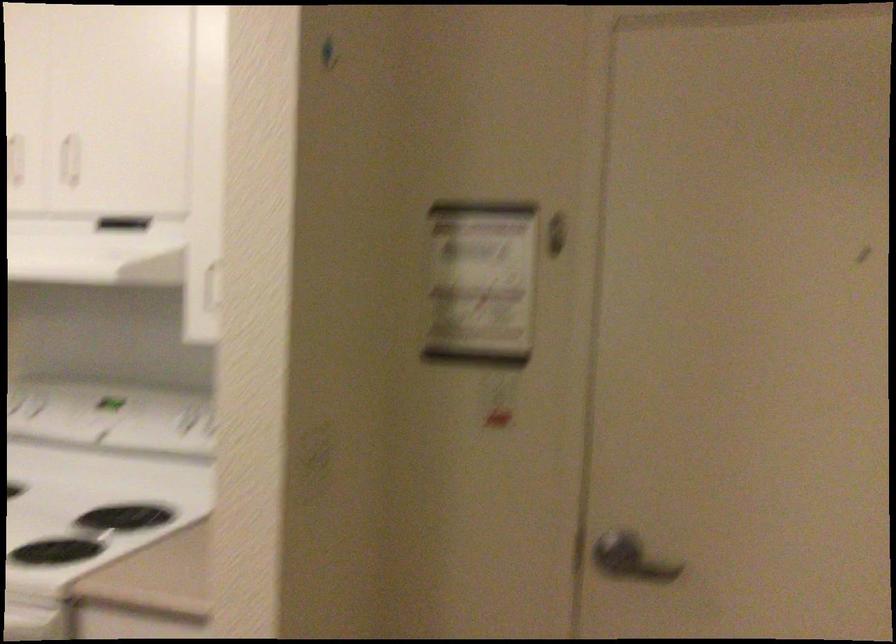
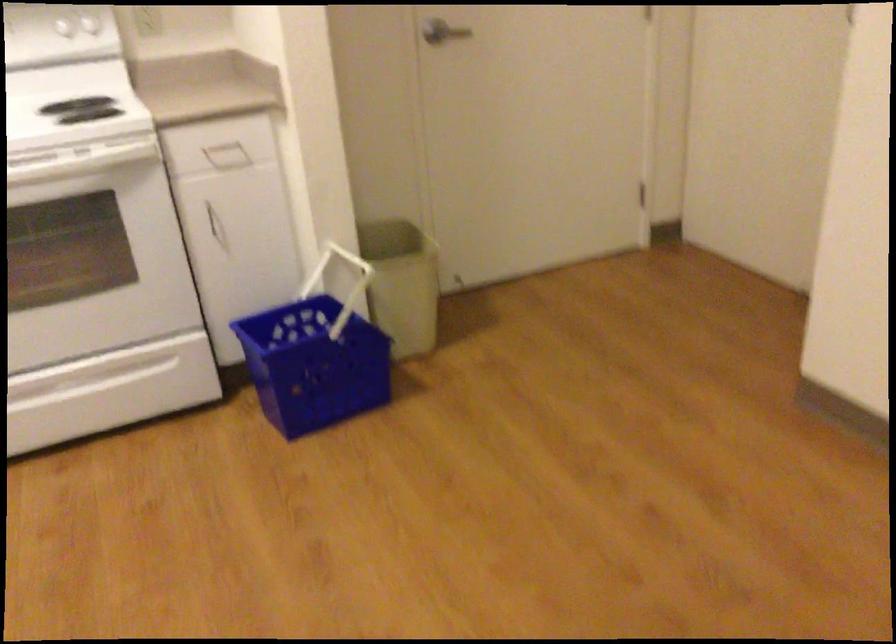
Locate, in the second image, the point that corresponds to the point at 609,574 in the first image.

(437, 35)